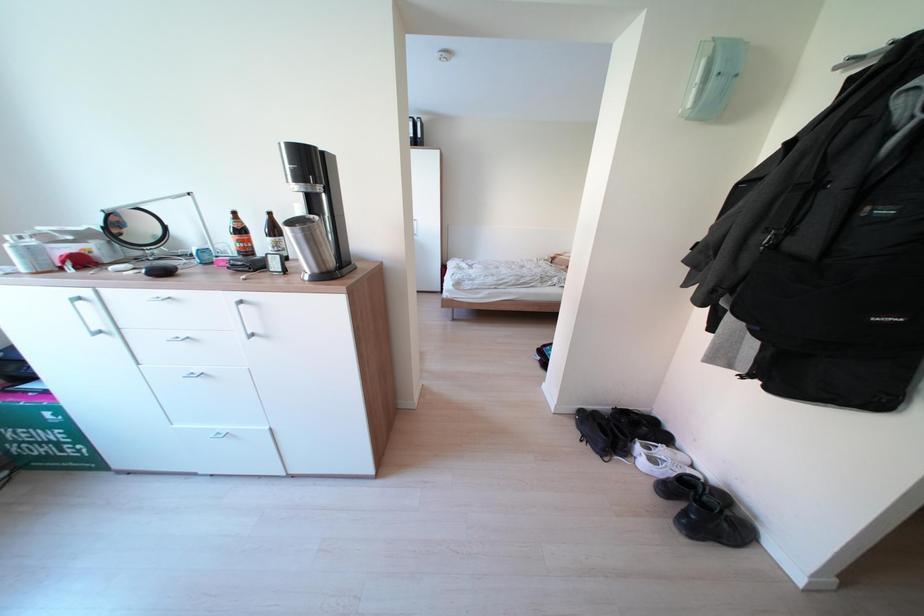
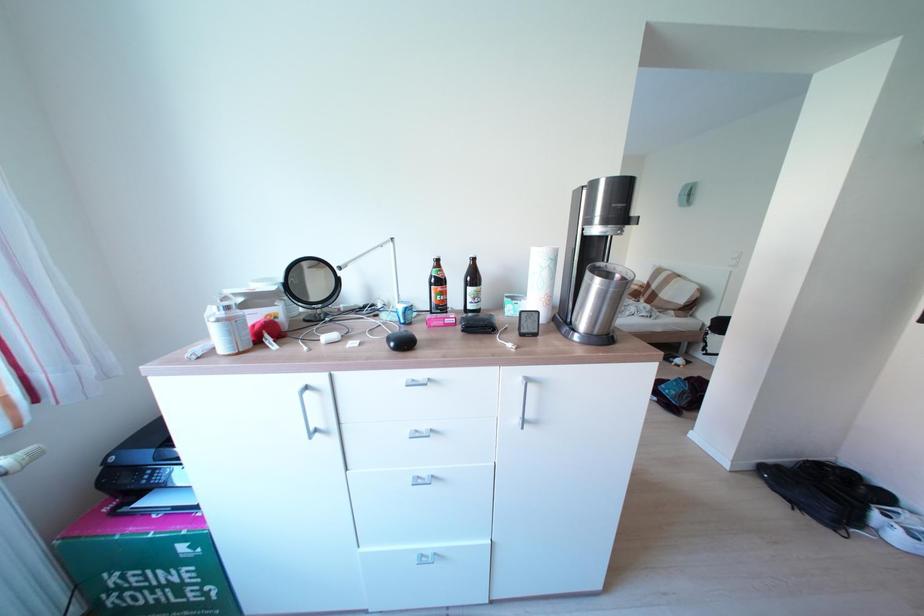
Question: In a continuous first-person perspective shot, in which direction is the camera moving?

Choices:
 (A) Left
 (B) Right
 (C) Forward
 (D) Backward

Answer: (A)